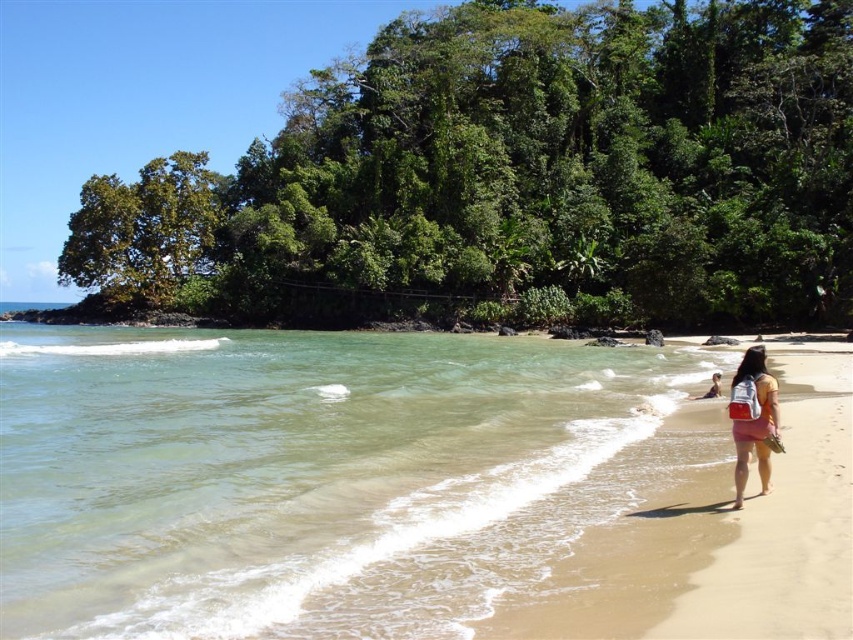
Question: Which point appears closest to the camera in this image?

Choices:
 (A) (717, 376)
 (B) (605, 589)
 (C) (347, 572)

Answer: (B)

Question: Is clear water at beach right bigger than matte pink shorts at lower right?

Choices:
 (A) no
 (B) yes

Answer: (B)

Question: Which object appears closest to the camera in this image?

Choices:
 (A) pink fabric dress at lower right
 (B) clear water at beach right

Answer: (B)

Question: Can you confirm if clear water at beach right is thinner than pink fabric dress at lower right?

Choices:
 (A) yes
 (B) no

Answer: (B)

Question: Does clear water at beach right appear on the right side of matte pink shorts at lower right?

Choices:
 (A) yes
 (B) no

Answer: (B)

Question: Based on their relative distances, which object is farther from the pink fabric dress at lower right?

Choices:
 (A) matte pink shorts at lower right
 (B) clear water at beach right

Answer: (B)